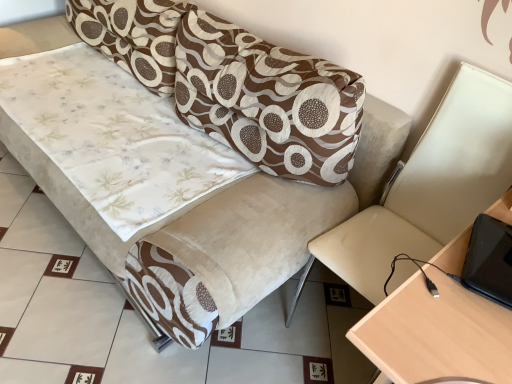
Where is `free spot to the left of beige leather swivel chair at right`? free spot to the left of beige leather swivel chair at right is located at coordinates (267, 333).